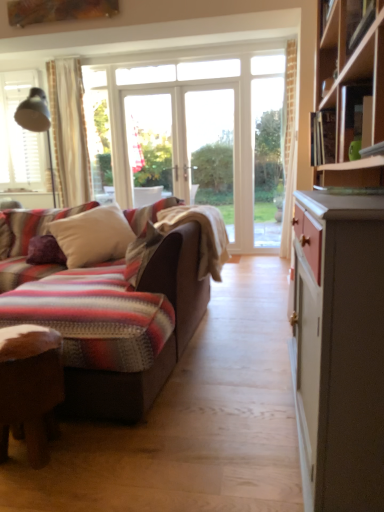
Question: Considering the relative positions of purple velvet pillow at left, placed as the first pillow when sorted from left to right, and white soft pillow at center, the second pillow in the left-to-right sequence, in the image provided, is purple velvet pillow at left, placed as the first pillow when sorted from left to right, to the left or to the right of white soft pillow at center, the second pillow in the left-to-right sequence,?

Choices:
 (A) right
 (B) left

Answer: (B)

Question: Choose the correct answer: Is purple velvet pillow at left, arranged as the second pillow when viewed from the right, inside white soft pillow at center, acting as the 1th pillow starting from the right, or outside it?

Choices:
 (A) outside
 (B) inside

Answer: (B)

Question: Which is farther from the white soft pillow at center, acting as the 1th pillow starting from the right?

Choices:
 (A) purple velvet pillow at left, placed as the first pillow when sorted from left to right
 (B) wooden desk at lower left
 (C) striped woolen blanket at center

Answer: (B)

Question: Which is nearer to the wooden desk at lower left?

Choices:
 (A) white soft pillow at center, acting as the 1th pillow starting from the right
 (B) striped woolen blanket at center
 (C) purple velvet pillow at left, placed as the first pillow when sorted from left to right

Answer: (B)